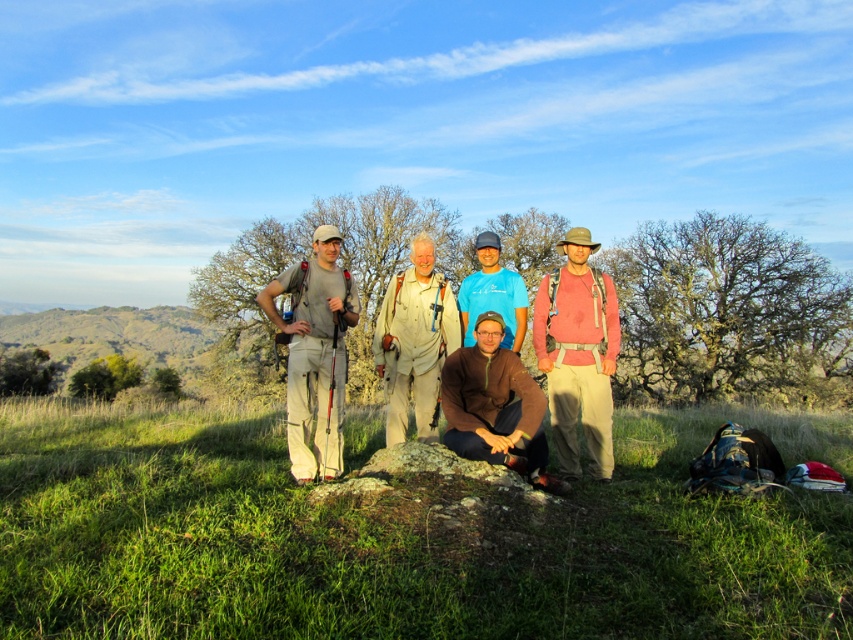
Question: Can you confirm if matte gray pants at left is bigger than blue t-shirt at center?

Choices:
 (A) no
 (B) yes

Answer: (B)

Question: Which of these objects is positioned closest to the pink fabric shirt at center?

Choices:
 (A) khaki cotton shirt at center
 (B) blue t-shirt at center

Answer: (B)

Question: Which object appears farthest from the camera in this image?

Choices:
 (A) matte gray pants at left
 (B) pink fabric shirt at center

Answer: (B)

Question: Does khaki cotton shirt at center have a larger size compared to blue t-shirt at center?

Choices:
 (A) no
 (B) yes

Answer: (B)

Question: Which is nearer to the pink fabric shirt at center?

Choices:
 (A) brown matte sweater at center
 (B) blue t-shirt at center
 (C) matte gray pants at left

Answer: (A)

Question: In this image, where is brown matte sweater at center located relative to khaki cotton shirt at center?

Choices:
 (A) below
 (B) above

Answer: (A)